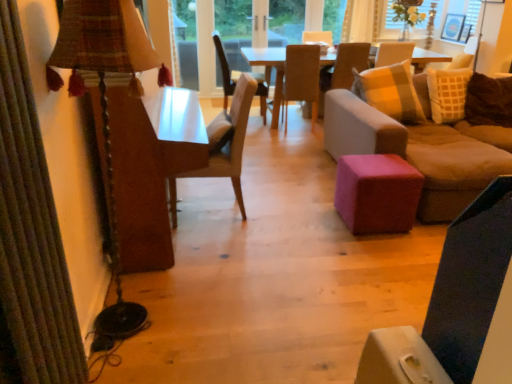
Question: From a real-world perspective, is woven fabric pillow at right physically located above or below white fabric at upper right?

Choices:
 (A) below
 (B) above

Answer: (A)

Question: Is woven fabric pillow at right spatially inside white fabric at upper right, or outside of it?

Choices:
 (A) outside
 (B) inside

Answer: (A)

Question: Estimate the real-world distances between objects in this image. Which object is closer to the pink fabric ottoman at center?

Choices:
 (A) light brown wooden chair at center, marked as the 1th chair in a right-to-left arrangement
 (B) woven fabric pillow at right
 (C) brown fabric chair at center, which ranks as the third chair in left-to-right order
 (D) pink fabric ottoman at center
 (E) light brown wooden table at center

Answer: (D)

Question: Estimate the real-world distances between objects in this image. Which object is closer to the white glass window frame at center?

Choices:
 (A) white sheer curtain at upper center
 (B) light brown wooden chair at center, which is the fourth chair in left-to-right order
 (C) pink fabric ottoman at center
 (D) wooden chair at center, placed as the first chair when sorted from front to back
 (E) pink fabric ottoman at center

Answer: (B)